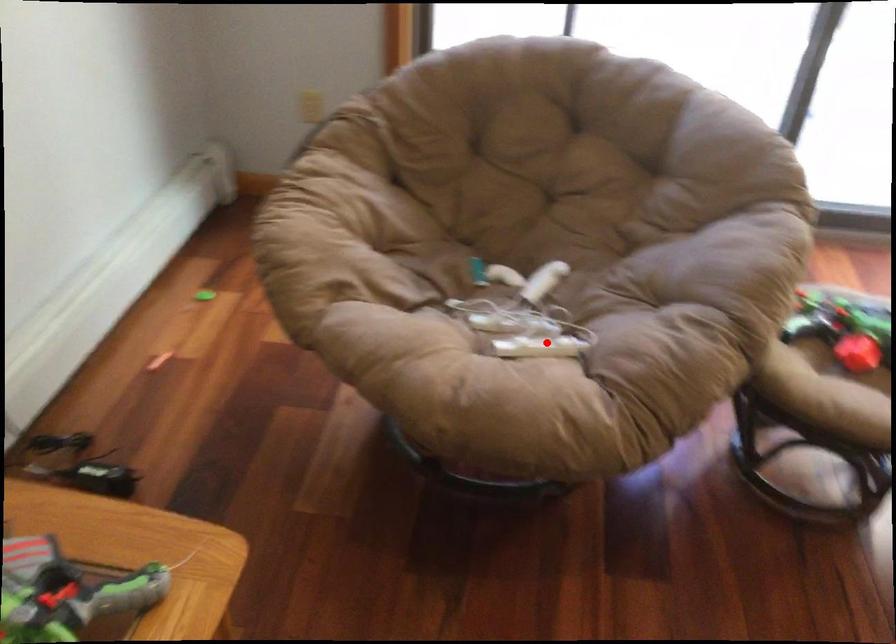
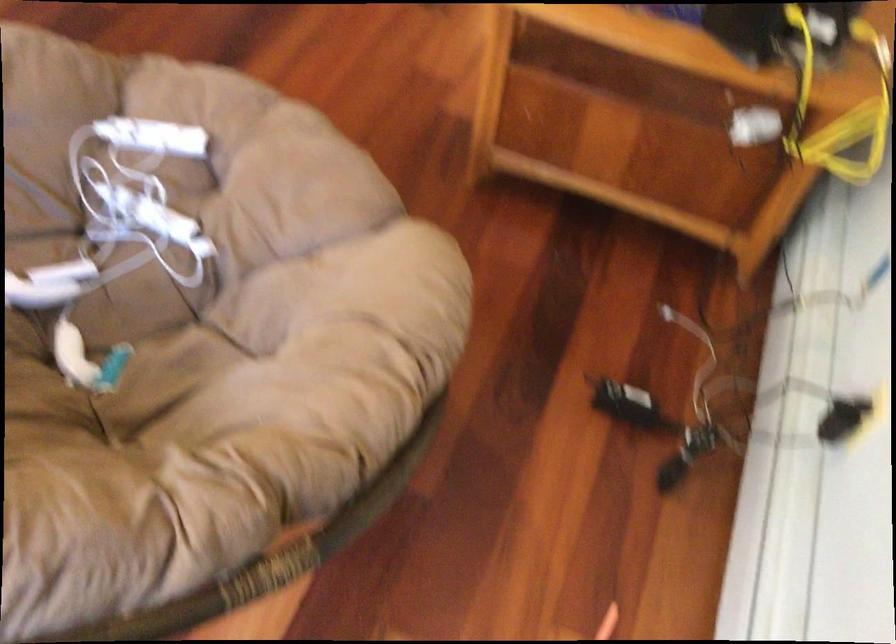
Question: A red point is marked in image1. In image2, is the corresponding 3D point closer to the camera or farther? Reply with the corresponding letter.

Choices:
 (A) The corresponding 3D point is closer.
 (B) The corresponding 3D point is farther.

Answer: (A)